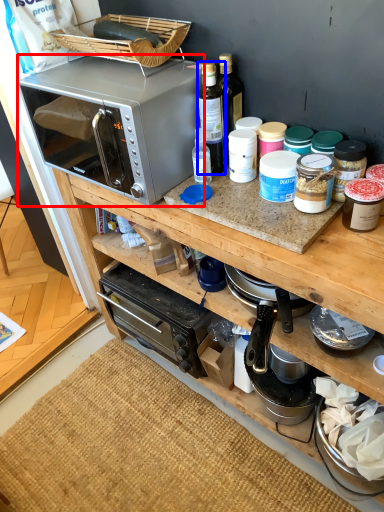
Question: Which of the following is the farthest to the observer, microwave oven (highlighted by a red box) or bottle (highlighted by a blue box)?

Choices:
 (A) microwave oven
 (B) bottle

Answer: (B)